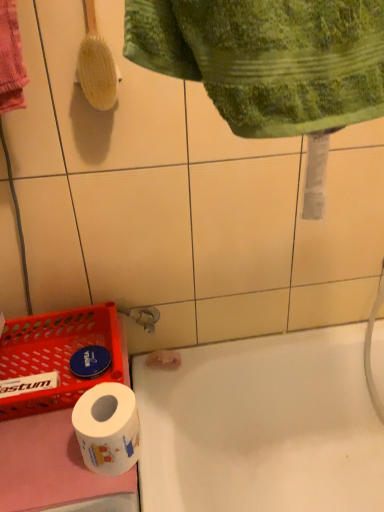
Question: Does yellow wooden brush at upper left appear on the left side of green textured towel at upper center?

Choices:
 (A) yes
 (B) no

Answer: (A)

Question: Can you confirm if yellow wooden brush at upper left is positioned to the right of green textured towel at upper center?

Choices:
 (A) no
 (B) yes

Answer: (A)

Question: Can you confirm if yellow wooden brush at upper left is taller than green textured towel at upper center?

Choices:
 (A) yes
 (B) no

Answer: (A)

Question: Does yellow wooden brush at upper left contain green textured towel at upper center?

Choices:
 (A) yes
 (B) no

Answer: (B)

Question: Is yellow wooden brush at upper left positioned in front of green textured towel at upper center?

Choices:
 (A) yes
 (B) no

Answer: (B)

Question: From a real-world perspective, is white glossy bathtub at lower center above or below yellow wooden brush at upper left?

Choices:
 (A) below
 (B) above

Answer: (A)

Question: Is point (266, 400) positioned closer to the camera than point (107, 100)?

Choices:
 (A) farther
 (B) closer

Answer: (A)

Question: Is white glossy bathtub at lower center in front of or behind yellow wooden brush at upper left in the image?

Choices:
 (A) behind
 (B) front

Answer: (A)

Question: Looking at their shapes, would you say white glossy bathtub at lower center is wider or thinner than yellow wooden brush at upper left?

Choices:
 (A) thin
 (B) wide

Answer: (B)

Question: Considering the relative positions of green textured towel at upper center and white glossy toilet paper at lower left in the image provided, is green textured towel at upper center to the left or to the right of white glossy toilet paper at lower left?

Choices:
 (A) left
 (B) right

Answer: (B)

Question: From a real-world perspective, is green textured towel at upper center above or below white glossy toilet paper at lower left?

Choices:
 (A) below
 (B) above

Answer: (B)

Question: In terms of height, does green textured towel at upper center look taller or shorter compared to white glossy toilet paper at lower left?

Choices:
 (A) short
 (B) tall

Answer: (B)

Question: Looking at their shapes, would you say green textured towel at upper center is wider or thinner than white glossy toilet paper at lower left?

Choices:
 (A) wide
 (B) thin

Answer: (B)

Question: From the image's perspective, relative to white glossy bathtub at lower center, is yellow wooden brush at upper left above or below?

Choices:
 (A) above
 (B) below

Answer: (A)

Question: Considering the positions of point (87, 33) and point (271, 460), is point (87, 33) closer or farther from the camera than point (271, 460)?

Choices:
 (A) farther
 (B) closer

Answer: (B)